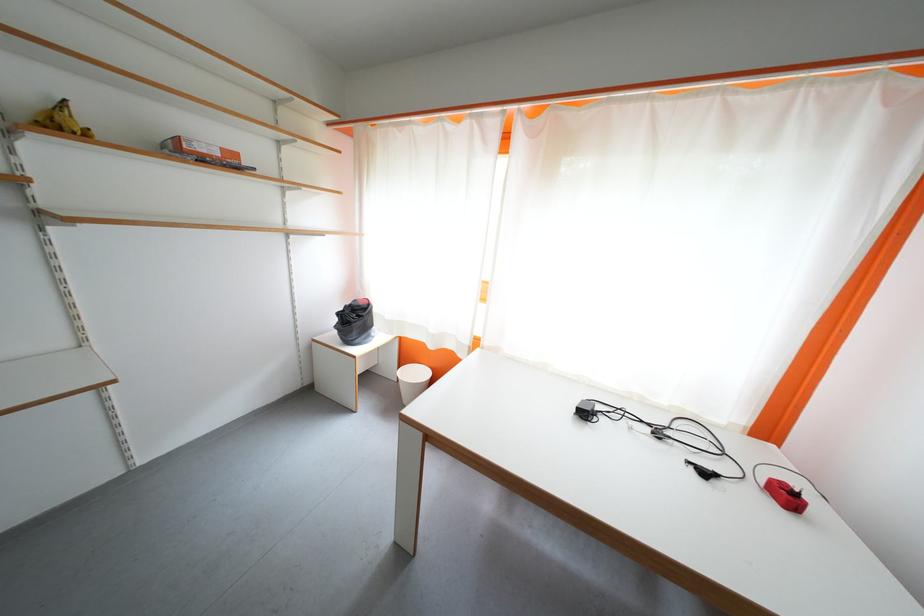
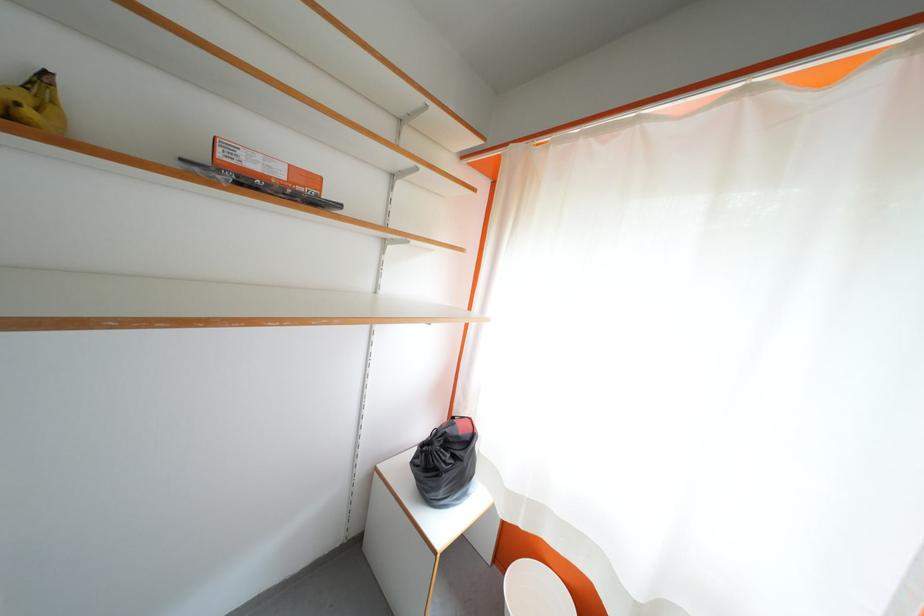
Locate, in the second image, the point that corresponds to point (362, 322) in the first image.

(455, 460)